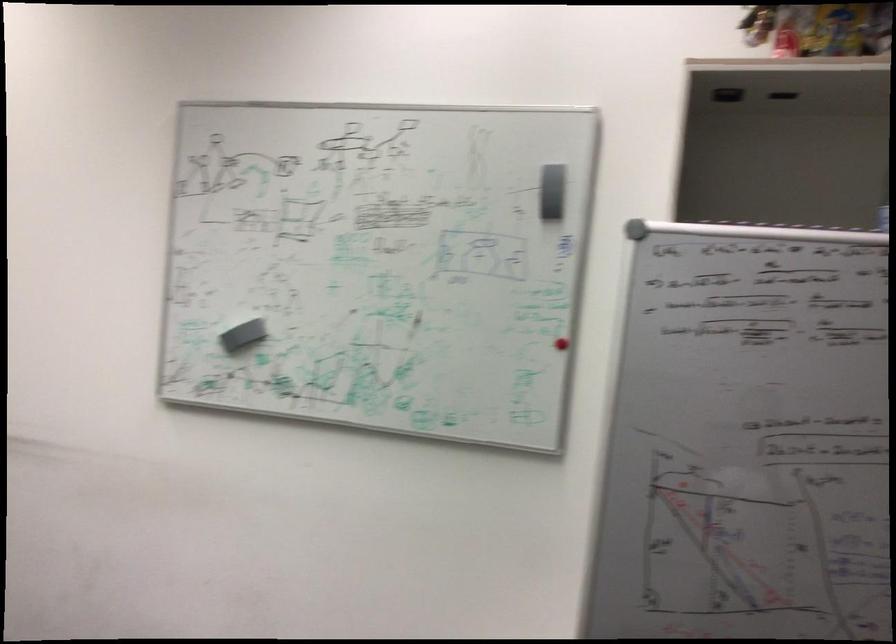
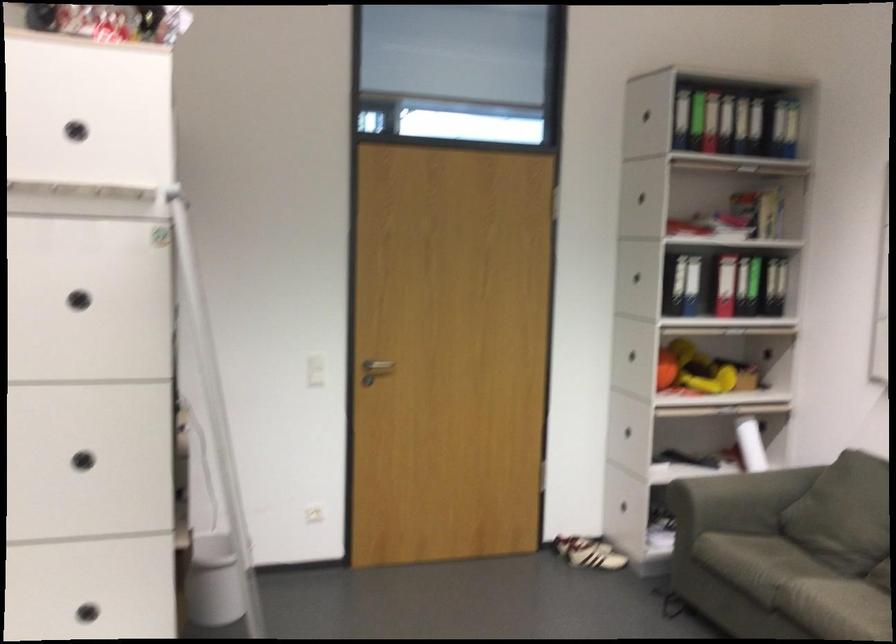
In the second image, find the point that corresponds to pixel 670 567 in the first image.

(83, 456)